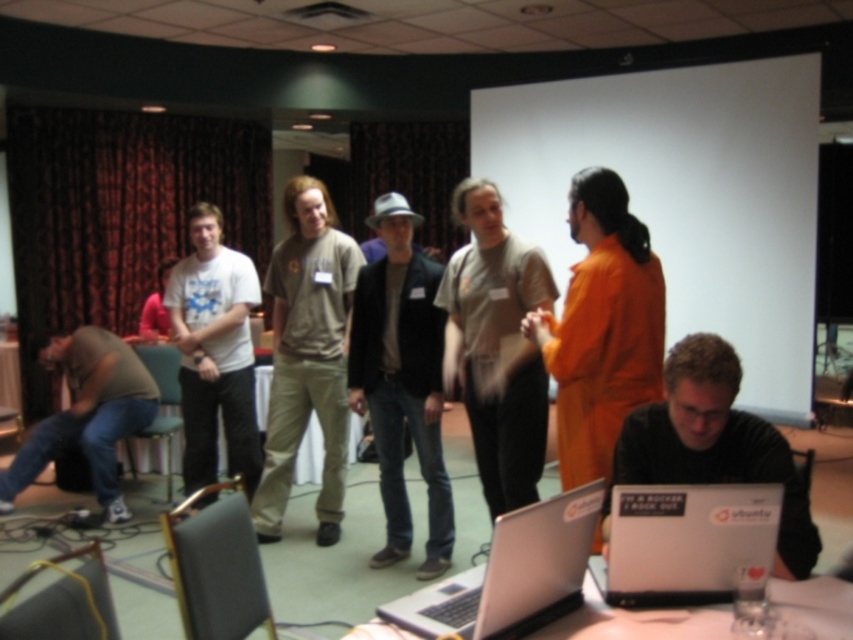
You are standing in the conference room and want to hand a document to the person wearing the matte brown shirt at lower left. The silver metallic laptop at lower center is blocking your path. Can you walk around it to reach the person?

The silver metallic laptop at lower center is closer to the viewer than the matte brown shirt at lower left, so you can walk around the laptop to reach the person wearing the matte brown shirt at lower left.

Where is the orange jumpsuit at center located in the image?

The orange jumpsuit at center is located at point coordinates of [601,326].

You are organizing a workshop and need to ensure that all equipment is visible to participants. The orange jumpsuit at center and the silver metallic laptop at lower center are both on the table. Which object is covering the other one, potentially blocking the view of the laptop?

The orange jumpsuit at center is positioned over the silver metallic laptop at lower center, so it is covering the laptop and blocking its view.